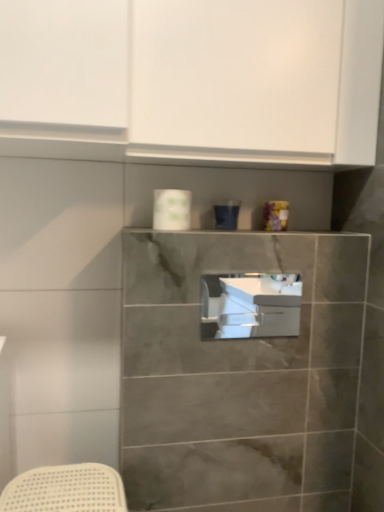
Question: Can you confirm if white matte cabinet at upper center is taller than white glossy toilet paper at upper center?

Choices:
 (A) no
 (B) yes

Answer: (B)

Question: From a real-world perspective, is white matte cabinet at upper center on top of white glossy toilet paper at upper center?

Choices:
 (A) yes
 (B) no

Answer: (A)

Question: From the image's perspective, is white matte cabinet at upper center over white glossy toilet paper at upper center?

Choices:
 (A) yes
 (B) no

Answer: (A)

Question: From the image's perspective, is white matte cabinet at upper center below white glossy toilet paper at upper center?

Choices:
 (A) yes
 (B) no

Answer: (B)

Question: Is white matte cabinet at upper center turned away from white glossy toilet paper at upper center?

Choices:
 (A) no
 (B) yes

Answer: (A)

Question: Is point (266, 97) positioned closer to the camera than point (173, 203)?

Choices:
 (A) closer
 (B) farther

Answer: (A)

Question: Considering the relative positions of white matte cabinet at upper center and white glossy toilet paper at upper center in the image provided, is white matte cabinet at upper center to the left or to the right of white glossy toilet paper at upper center?

Choices:
 (A) right
 (B) left

Answer: (A)

Question: Is white matte cabinet at upper center wider or thinner than white glossy toilet paper at upper center?

Choices:
 (A) wide
 (B) thin

Answer: (A)

Question: In the image, is white matte cabinet at upper center positioned in front of or behind white glossy toilet paper at upper center?

Choices:
 (A) behind
 (B) front

Answer: (B)

Question: Is white glossy toilet paper at upper center in front of or behind white glossy sink at center in the image?

Choices:
 (A) behind
 (B) front

Answer: (A)

Question: Looking at their shapes, would you say white glossy toilet paper at upper center is wider or thinner than white glossy sink at center?

Choices:
 (A) wide
 (B) thin

Answer: (A)

Question: From their relative heights in the image, would you say white glossy toilet paper at upper center is taller or shorter than white glossy sink at center?

Choices:
 (A) tall
 (B) short

Answer: (B)

Question: From the image's perspective, is white glossy toilet paper at upper center located above or below white glossy sink at center?

Choices:
 (A) above
 (B) below

Answer: (A)

Question: From their relative heights in the image, would you say white glossy toilet paper at upper center is taller or shorter than white matte cabinet at upper center?

Choices:
 (A) short
 (B) tall

Answer: (A)

Question: Is white glossy toilet paper at upper center inside the boundaries of white matte cabinet at upper center, or outside?

Choices:
 (A) outside
 (B) inside

Answer: (A)